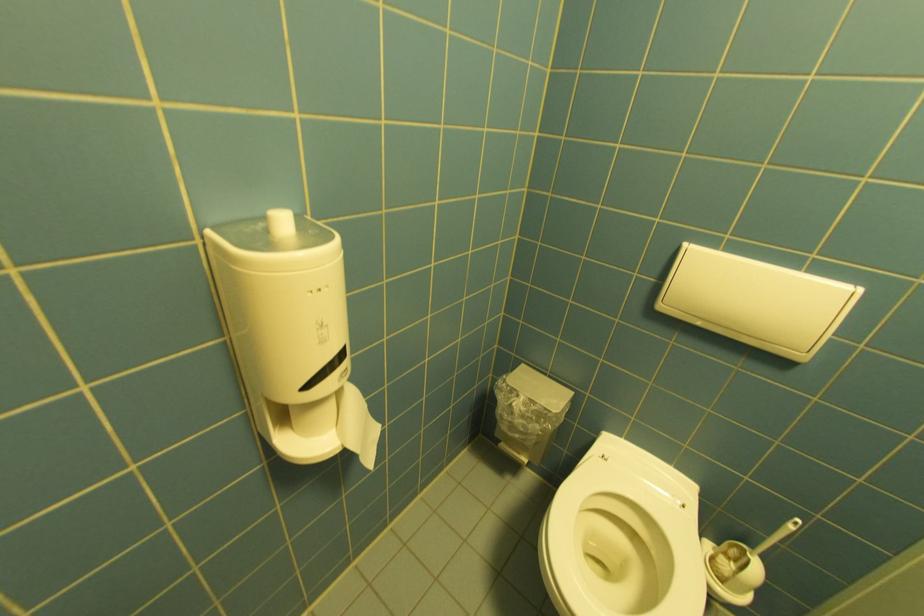
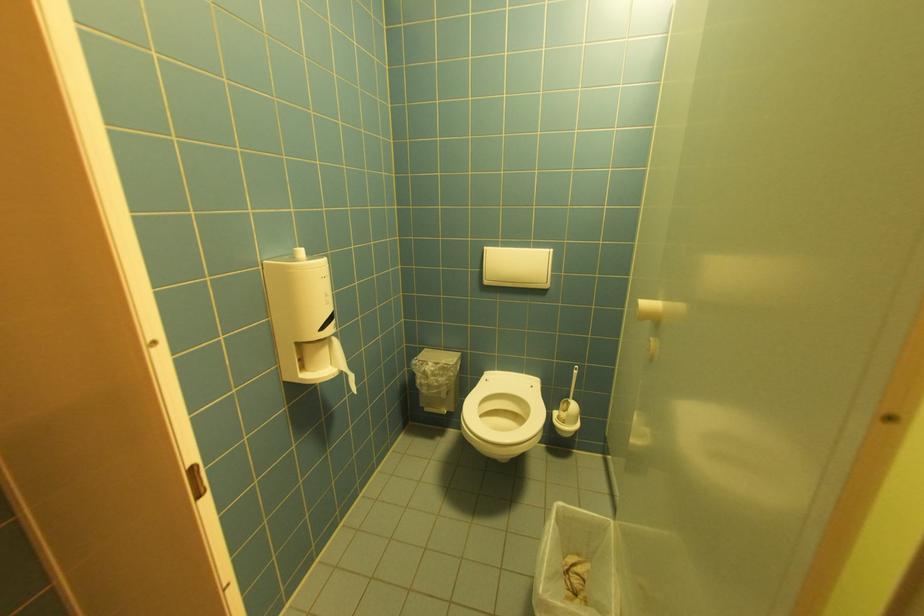
The point at [666,308] is marked in the first image. Where is the corresponding point in the second image?

(492, 283)